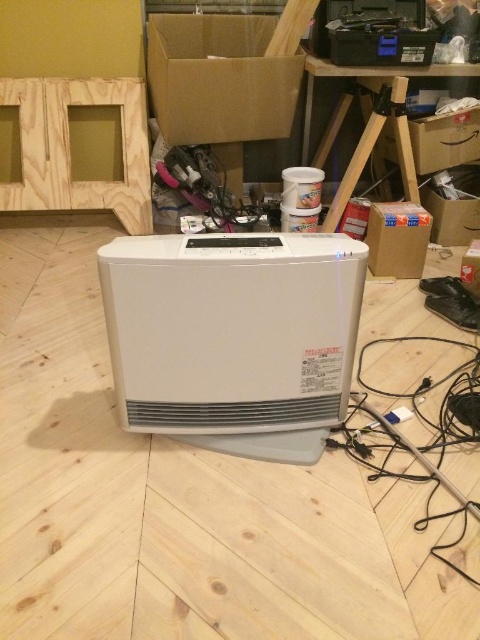
You are standing in the room and want to reach the point at coordinates point (237, 54). If your reach extends 2 meters, can you touch it without moving?

The point (237, 54) is 2.49 meters away from you, which is beyond your 2 meter reach. You cannot touch it without moving closer.

You are standing at the entrance of the room and want to place a new plant pot near the white plastic heater at center. If the entrance is at the bottom of the image, where should you position the plant pot relative to the heater?

The white plastic heater at center is located at point coordinates, so you should position the plant pot near the heater at the specified coordinates.

You are standing in the workspace and see the white air purifier or heater with a control panel at the top and the partially assembled wooden frame leaning against the wall. There is also a brown cardboard box at upper center located at point (225, 74). Which object is closer to the control panel of the air purifier or heater?

The brown cardboard box at upper center located at point (225, 74) is closer to the control panel of the air purifier or heater than the partially assembled wooden frame leaning against the wall.